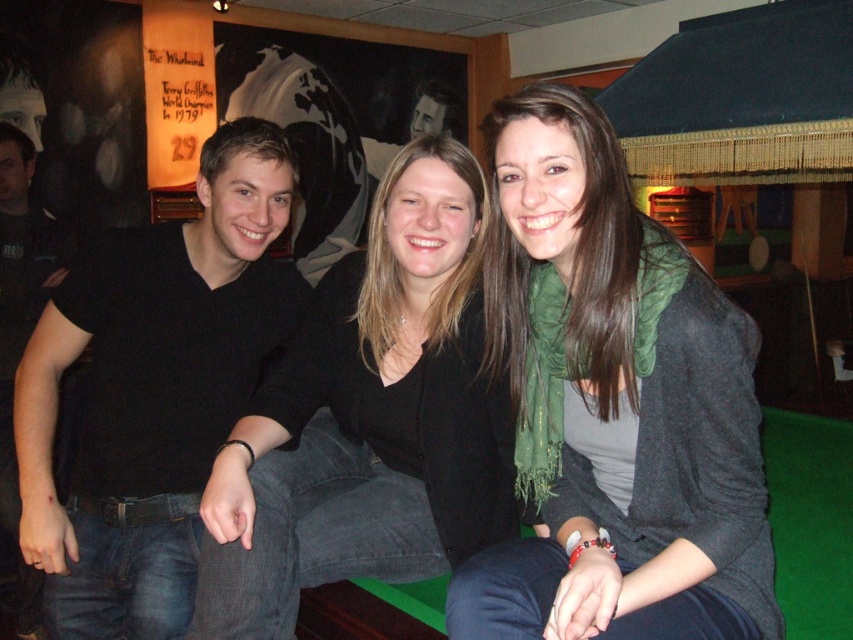
Is green scarf at center further to camera compared to black matte shirt at center?

That is False.

Can you confirm if green scarf at center is positioned to the left of black matte shirt at center?

Incorrect, green scarf at center is not on the left side of black matte shirt at center.

Where is `green scarf at center`? green scarf at center is located at coordinates (612, 404).

Locate an element on the screen. The width and height of the screenshot is (853, 640). green scarf at center is located at coordinates (612, 404).